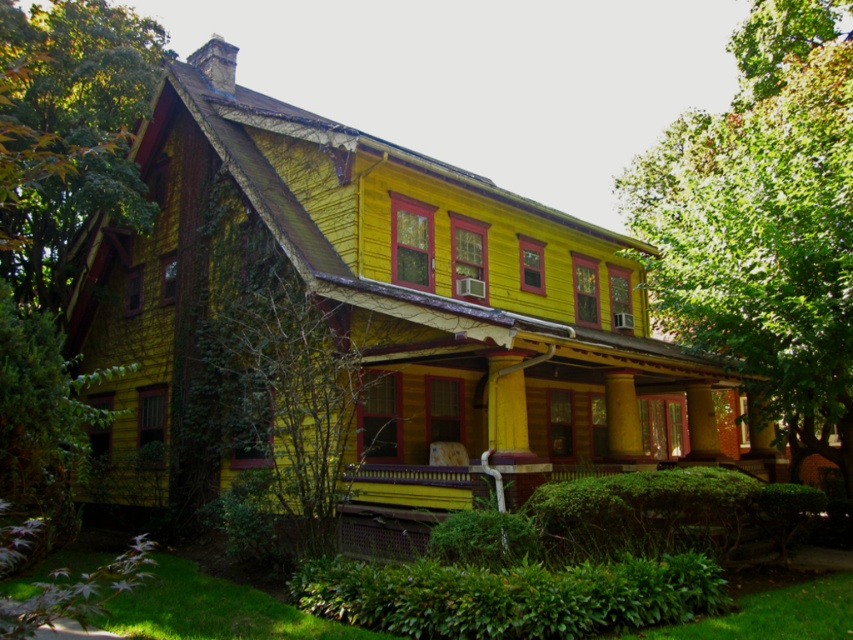
Measure the distance from green leafy tree at left to green leafy tree at center.

A distance of 9.72 meters exists between green leafy tree at left and green leafy tree at center.

Consider the image. Does green leafy tree at left appear under green leafy tree at center?

No.

Is point (123, 196) behind point (320, 385)?

Yes, it is behind point (320, 385).

This screenshot has height=640, width=853. I want to click on green leafy tree at left, so click(74, 131).

Consider the image. Does green leafy tree at upper right have a smaller size compared to green leafy tree at left?

Incorrect, green leafy tree at upper right is not smaller in size than green leafy tree at left.

Based on the photo, does green leafy tree at upper right come in front of green leafy tree at left?

No, green leafy tree at upper right is behind green leafy tree at left.

Between point (660, 296) and point (59, 264), which one is positioned in front?

Positioned in front is point (59, 264).

At what (x,y) coordinates should I click in order to perform the action: click on green leafy tree at upper right. Please return your answer as a coordinate pair (x, y). The width and height of the screenshot is (853, 640). Looking at the image, I should click on (764, 225).

Can you confirm if green leafy tree at upper right is positioned above green leafy tree at center?

Yes.

Is green leafy tree at upper right thinner than green leafy tree at center?

No, green leafy tree at upper right is not thinner than green leafy tree at center.

Between point (802, 230) and point (256, 481), which one is positioned in front?

Point (256, 481) is in front.

The width and height of the screenshot is (853, 640). In order to click on green leafy tree at upper right in this screenshot , I will do `click(764, 225)`.